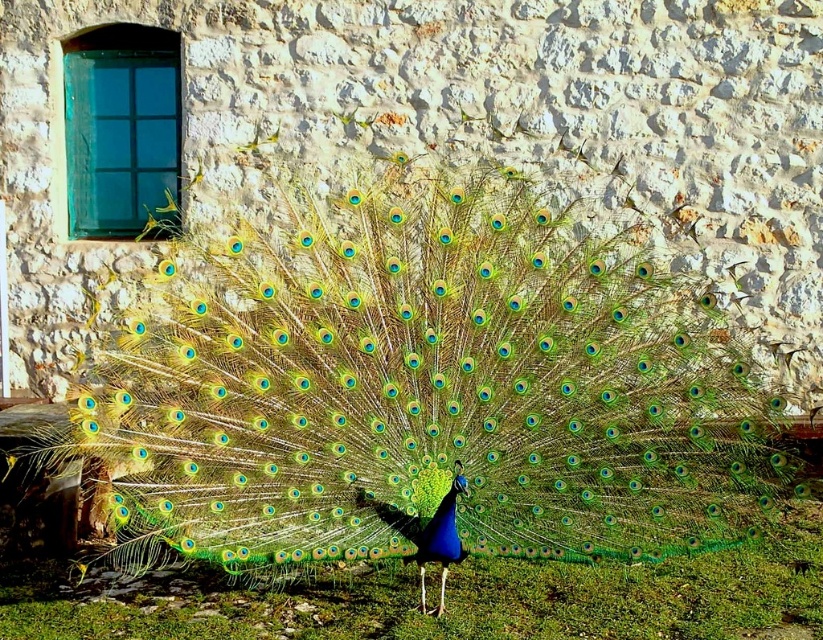
You are standing in front of the stone wall and see the green iridescent peacock at center and the green grass at center. Which object is positioned to the left of the other?

The green iridescent peacock at center is to the left of green grass at center.

You are standing in a garden and see the green iridescent peacock at center. If you want to take a photo of it without including the stone wall in the background, where should you position yourself relative to the peacock?

To avoid including the stone wall in the background when photographing the green iridescent peacock at center, you should position yourself to the left side of the peacock since the window is on the left side of the stone wall, providing an alternative background.

Based on the photo, you are a photographer trying to capture the peacock and the grass in the image. Since both are green, how can you distinguish the green iridescent peacock at center from the green grass at center based on their size?

The green iridescent peacock at center is larger in size than the green grass at center, so you can tell them apart by noting that the peacock is bigger.